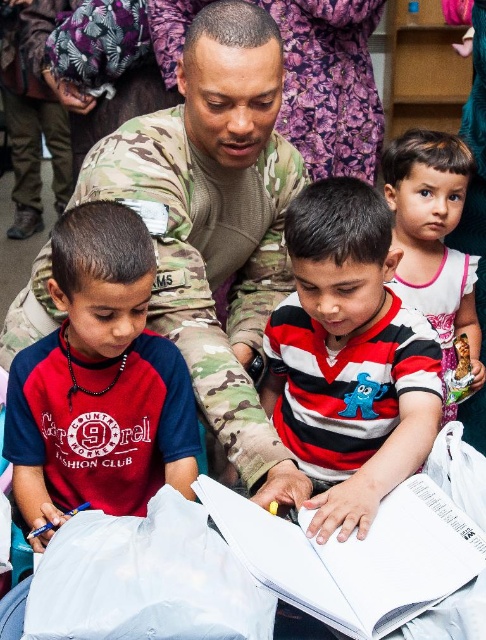
Question: Which point is closer to the camera taking this photo?

Choices:
 (A) pyautogui.click(x=159, y=252)
 (B) pyautogui.click(x=301, y=26)
 (C) pyautogui.click(x=400, y=308)

Answer: (C)

Question: Which of the following is the farthest from the observer?

Choices:
 (A) (301, 61)
 (B) (456, 147)

Answer: (A)

Question: Can you confirm if camo uniform at center is positioned below matte red t-shirt at left?

Choices:
 (A) no
 (B) yes

Answer: (A)

Question: Is striped cotton shirt at center to the right of matte white shirt at upper right from the viewer's perspective?

Choices:
 (A) yes
 (B) no

Answer: (B)

Question: From the image, what is the correct spatial relationship of camo uniform at center in relation to striped cotton shirt at center?

Choices:
 (A) below
 (B) above

Answer: (B)

Question: Among these points, which one is nearest to the camera?

Choices:
 (A) (277, 400)
 (B) (58, 308)
 (C) (29, 381)

Answer: (C)